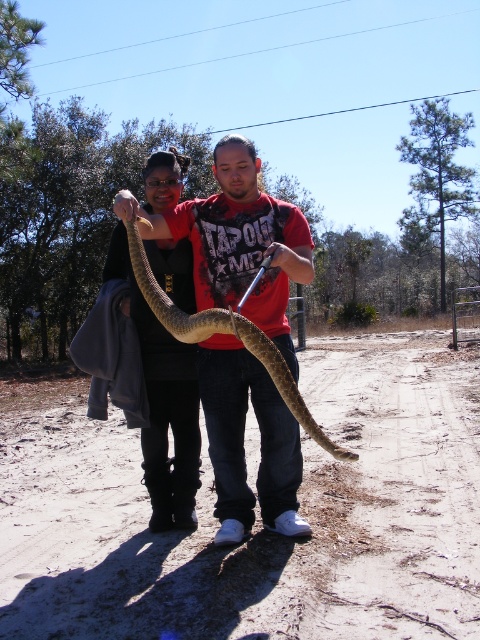
Question: Is dirt track at lower center wider than brown scaly snake at center?

Choices:
 (A) no
 (B) yes

Answer: (B)

Question: Is dirt track at lower center to the left of brown scaly snake at center from the viewer's perspective?

Choices:
 (A) no
 (B) yes

Answer: (B)

Question: Does dirt track at lower center come in front of brown scaly snake at center?

Choices:
 (A) yes
 (B) no

Answer: (A)